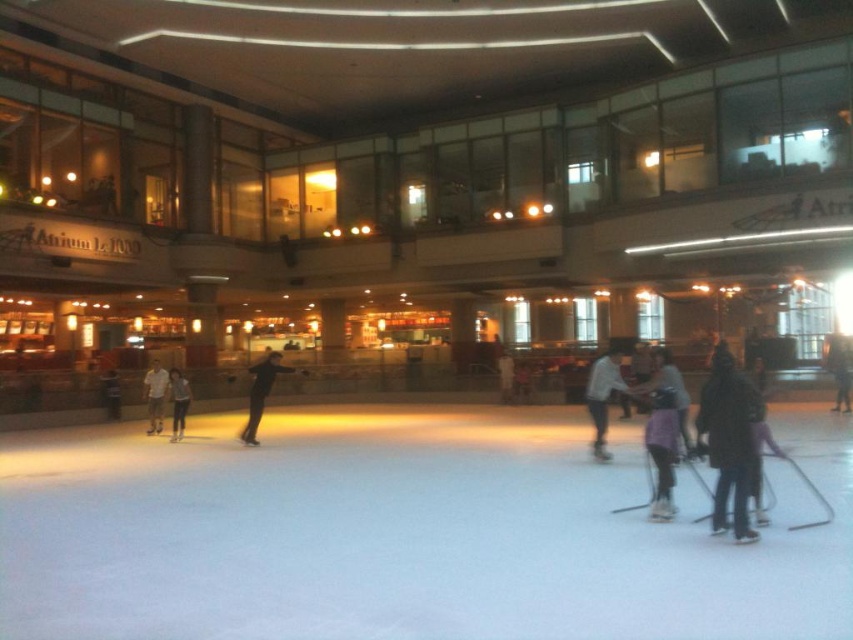
Question: Does purple fabric at center have a larger size compared to light gray cotton shirt at center?

Choices:
 (A) no
 (B) yes

Answer: (A)

Question: Which point is closer to the camera taking this photo?

Choices:
 (A) (173, 381)
 (B) (743, 515)
 (C) (160, 426)
 (D) (257, 374)

Answer: (B)

Question: Is light gray sweater at center positioned in front of light gray cotton shirt at center?

Choices:
 (A) no
 (B) yes

Answer: (B)

Question: Which point appears farthest from the camera in this image?

Choices:
 (A) (155, 419)
 (B) (735, 445)
 (C) (666, 492)

Answer: (A)

Question: Which point is farther from the camera taking this photo?

Choices:
 (A) (604, 358)
 (B) (148, 429)
 (C) (740, 490)
 (D) (248, 396)

Answer: (D)

Question: Can you confirm if light gray sweater at center is positioned to the right of denim pants at center?

Choices:
 (A) no
 (B) yes

Answer: (B)